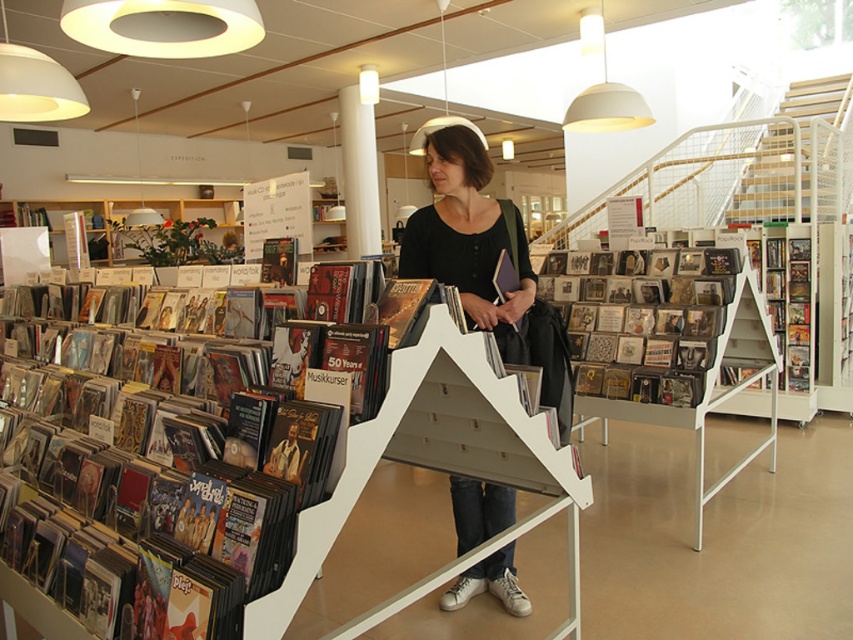
Can you confirm if black matte shirt at center is shorter than white wooden stairs at upper center?

Yes.

Between point (463, 152) and point (822, 81), which one is positioned behind?

Positioned behind is point (822, 81).

The width and height of the screenshot is (853, 640). In order to click on black matte shirt at center in this screenshot , I will do `click(466, 232)`.

Who is higher up, black matte shirt at center or white smooth pillar at center?

white smooth pillar at center is higher up.

Is black matte shirt at center to the right of white smooth pillar at center from the viewer's perspective?

Correct, you'll find black matte shirt at center to the right of white smooth pillar at center.

Does point (479, 204) lie behind point (370, 248)?

No.

The image size is (853, 640). Identify the location of black matte shirt at center. (466, 232).

Is point (166, 449) positioned after point (790, 218)?

No, (166, 449) is closer to viewer.

Does point (263, 372) come closer to viewer compared to point (782, 148)?

That is True.

This screenshot has width=853, height=640. Identify the location of matte black vinyl records at left. (90, 420).